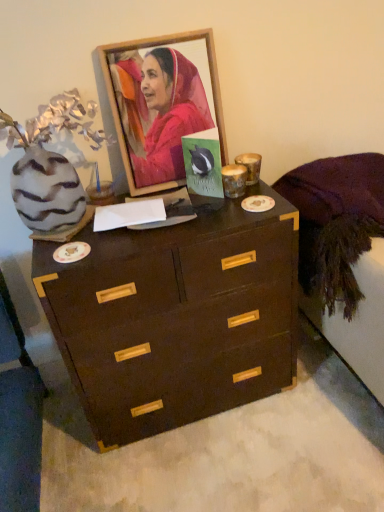
At what (x,y) coordinates should I click in order to perform the action: click on free space in front of dark wood chest of drawers at center. Please return your answer as a coordinate pair (x, y). This screenshot has height=512, width=384. Looking at the image, I should click on (213, 467).